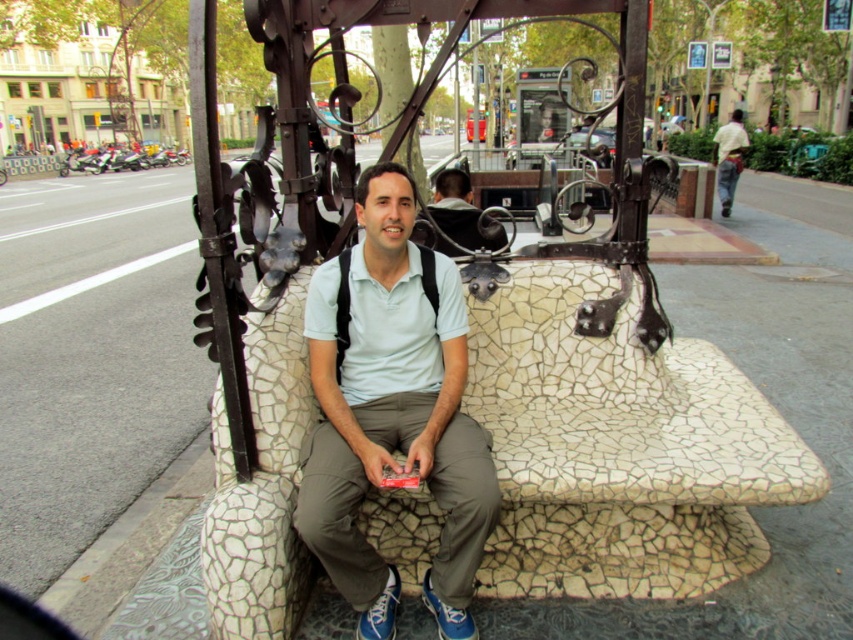
Question: Is matte white bench at center to the right of light yellow shirt at right from the viewer's perspective?

Choices:
 (A) yes
 (B) no

Answer: (B)

Question: Is matte white bench at center closer to camera compared to light yellow shirt at right?

Choices:
 (A) yes
 (B) no

Answer: (A)

Question: Estimate the real-world distances between objects in this image. Which object is farther from the matte white shirt at center?

Choices:
 (A) matte white bench at center
 (B) light yellow shirt at right

Answer: (B)

Question: Which object is positioned farthest from the matte white bench at center?

Choices:
 (A) light yellow shirt at right
 (B) matte white shirt at center

Answer: (A)

Question: Where is matte white bench at center located in relation to light yellow shirt at right in the image?

Choices:
 (A) below
 (B) above

Answer: (A)

Question: Which point is farther to the camera?

Choices:
 (A) (728, 193)
 (B) (376, 312)
 (C) (500, 225)

Answer: (A)